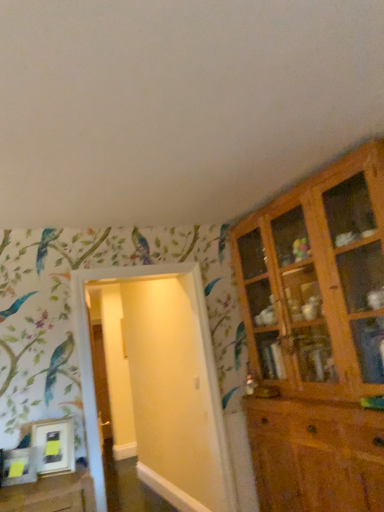
Question: Considering the positions of white glossy door at center and wooden cabinet at right in the image, is white glossy door at center taller or shorter than wooden cabinet at right?

Choices:
 (A) short
 (B) tall

Answer: (A)

Question: From the image's perspective, relative to wooden cabinet at right, is white glossy door at center above or below?

Choices:
 (A) below
 (B) above

Answer: (A)

Question: Considering the relative positions of white glossy door at center and wooden cabinet at right in the image provided, is white glossy door at center to the left or to the right of wooden cabinet at right?

Choices:
 (A) left
 (B) right

Answer: (A)

Question: Is wooden cabinet at right inside the boundaries of white glossy door at center, or outside?

Choices:
 (A) inside
 (B) outside

Answer: (B)

Question: Does point (352, 256) appear closer or farther from the camera than point (137, 401)?

Choices:
 (A) closer
 (B) farther

Answer: (A)

Question: Based on their sizes in the image, would you say wooden cabinet at right is bigger or smaller than white glossy door at center?

Choices:
 (A) big
 (B) small

Answer: (A)

Question: From the image's perspective, is wooden cabinet at right above or below white glossy door at center?

Choices:
 (A) below
 (B) above

Answer: (B)